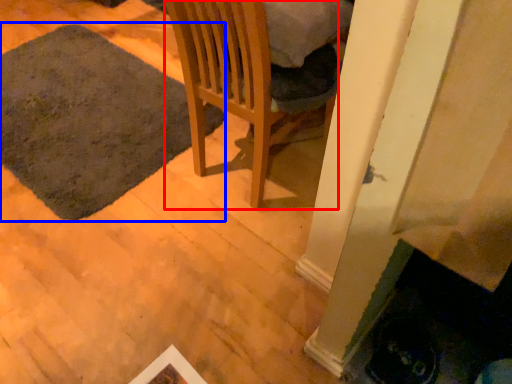
Question: Which object appears farthest to the camera in this image, chair (highlighted by a red box) or mat (highlighted by a blue box)?

Choices:
 (A) chair
 (B) mat

Answer: (B)